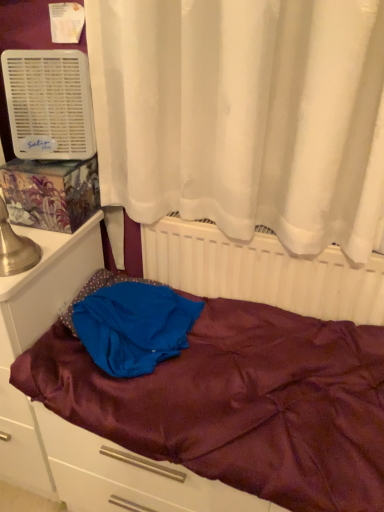
The width and height of the screenshot is (384, 512). What do you see at coordinates (36, 339) in the screenshot?
I see `matte white file cabinet at left` at bounding box center [36, 339].

Where is `blue satin blanket at center`? Image resolution: width=384 pixels, height=512 pixels. blue satin blanket at center is located at coordinates (134, 326).

I want to click on white plastic air conditioner at upper left, so click(49, 104).

Find the location of a particular element. Image resolution: width=384 pixels, height=512 pixels. white plastic radiator at center is located at coordinates (262, 272).

Consider the image. Is maroon satin bed at center at the back of matte white file cabinet at left?

matte white file cabinet at left does not have its back to maroon satin bed at center.

Considering the positions of points (79, 244) and (120, 453), is point (79, 244) closer to camera compared to point (120, 453)?

That is False.

Are matte white file cabinet at left and maroon satin bed at center making contact?

No.

Which object is positioned more to the right, matte white file cabinet at left or maroon satin bed at center?

Positioned to the right is maroon satin bed at center.

Consider the image. Does maroon satin bed at center touch white plastic air conditioner at upper left?

No, maroon satin bed at center is not in contact with white plastic air conditioner at upper left.

From a real-world perspective, is maroon satin bed at center above or below white plastic air conditioner at upper left?

From a real-world perspective, maroon satin bed at center is physically below white plastic air conditioner at upper left.

Is maroon satin bed at center to the left or to the right of white plastic air conditioner at upper left in the image?

Clearly, maroon satin bed at center is on the right of white plastic air conditioner at upper left in the image.

Between point (50, 306) and point (68, 81), which one is positioned behind?

The point (50, 306) is more distant.

From the image's perspective, is white plastic radiator at center located above maroon satin bed at center?

Yes.

Which point is more distant from viewer, (182, 234) or (89, 428)?

The point (182, 234) is behind.

Can you tell me how much blue satin blanket at center and white plastic air conditioner at upper left differ in facing direction?

The facing directions of blue satin blanket at center and white plastic air conditioner at upper left are 24.5 degrees apart.

From the image's perspective, is blue satin blanket at center below white plastic air conditioner at upper left?

Yes, from the image's perspective, blue satin blanket at center is beneath white plastic air conditioner at upper left.

Between blue satin blanket at center and white plastic air conditioner at upper left, which one has smaller size?

Smaller between the two is white plastic air conditioner at upper left.

Which object is wider, blue satin blanket at center or white plastic air conditioner at upper left?

Answer: blue satin blanket at center.

Which of these two, matte white file cabinet at left or white plastic air conditioner at upper left, is wider?

matte white file cabinet at left is wider.

Does matte white file cabinet at left have a lesser height compared to white plastic air conditioner at upper left?

Incorrect, the height of matte white file cabinet at left does not fall short of that of white plastic air conditioner at upper left.

Is matte white file cabinet at left next to white plastic air conditioner at upper left?

No, matte white file cabinet at left is not touching white plastic air conditioner at upper left.

Does point (16, 445) lie in front of point (72, 156)?

No, (16, 445) is behind (72, 156).

From a real-world perspective, is maroon satin bed at center positioned over white plastic radiator at center based on gravity?

No, from a real-world perspective, maroon satin bed at center is not above white plastic radiator at center.

From the image's perspective, which is above, maroon satin bed at center or white plastic radiator at center?

white plastic radiator at center, from the image's perspective.

Considering the positions of objects white plastic radiator at center and blue satin blanket at center in the image provided, who is more to the left, white plastic radiator at center or blue satin blanket at center?

Positioned to the left is blue satin blanket at center.

Considering the sizes of white plastic radiator at center and blue satin blanket at center in the image, is white plastic radiator at center taller or shorter than blue satin blanket at center?

Clearly, white plastic radiator at center is taller compared to blue satin blanket at center.

How many degrees apart are the facing directions of white plastic radiator at center and blue satin blanket at center?

3.55 degrees.

Measure the distance from white plastic radiator at center to blue satin blanket at center.

white plastic radiator at center and blue satin blanket at center are 7.95 inches apart from each other.

At what (x,y) coordinates should I click in order to perform the action: click on file cabinet that is below the maroon satin bed at center (from the image's perspective). Please return your answer as a coordinate pair (x, y). This screenshot has height=512, width=384. Looking at the image, I should click on (36, 339).

Locate an element on the screen. air conditioning lying on the left of maroon satin bed at center is located at coordinates (49, 104).

Looking at the image, which one is located closer to white plastic air conditioner at upper left, matte white file cabinet at left or white plastic radiator at center?

Based on the image, matte white file cabinet at left appears to be nearer to white plastic air conditioner at upper left.

Estimate the real-world distances between objects in this image. Which object is further from white plastic radiator at center, matte white file cabinet at left or blue satin blanket at center?

matte white file cabinet at left is positioned further to the anchor white plastic radiator at center.

Based on their spatial positions, is blue satin blanket at center or white plastic radiator at center further from maroon satin bed at center?

Among the two, white plastic radiator at center is located further to maroon satin bed at center.

Which object lies nearer to the anchor point matte white file cabinet at left, maroon satin bed at center or white plastic air conditioner at upper left?

maroon satin bed at center is closer to matte white file cabinet at left.

Based on their spatial positions, is white plastic air conditioner at upper left or matte white file cabinet at left further from maroon satin bed at center?

The object further to maroon satin bed at center is white plastic air conditioner at upper left.

When comparing their distances from white plastic radiator at center, does blue satin blanket at center or maroon satin bed at center seem further?

Based on the image, maroon satin bed at center appears to be further to white plastic radiator at center.

Consider the image. Based on their spatial positions, is matte white file cabinet at left or blue satin blanket at center further from white plastic air conditioner at upper left?

blue satin blanket at center.

Considering their positions, is white plastic air conditioner at upper left positioned closer to white plastic radiator at center than matte white file cabinet at left?

Among the two, matte white file cabinet at left is located nearer to white plastic radiator at center.

You are a GUI agent. You are given a task and a screenshot of the screen. Output one action in this format:
    pyautogui.click(x=<x>, y=<y>)
    Task: Click on the blanket between matte white file cabinet at left and maroon satin bed at center
    The image size is (384, 512).
    Given the screenshot: What is the action you would take?
    pyautogui.click(x=134, y=326)

The height and width of the screenshot is (512, 384). What are the coordinates of `bed between white plastic air conditioner at upper left and matte white file cabinet at left from top to bottom` in the screenshot? It's located at tap(98, 463).

Locate an element on the screen. The image size is (384, 512). blanket that lies between white plastic air conditioner at upper left and maroon satin bed at center from top to bottom is located at coordinates (134, 326).

Locate an element on the screen. The height and width of the screenshot is (512, 384). blanket between matte white file cabinet at left and white plastic radiator at center is located at coordinates (134, 326).